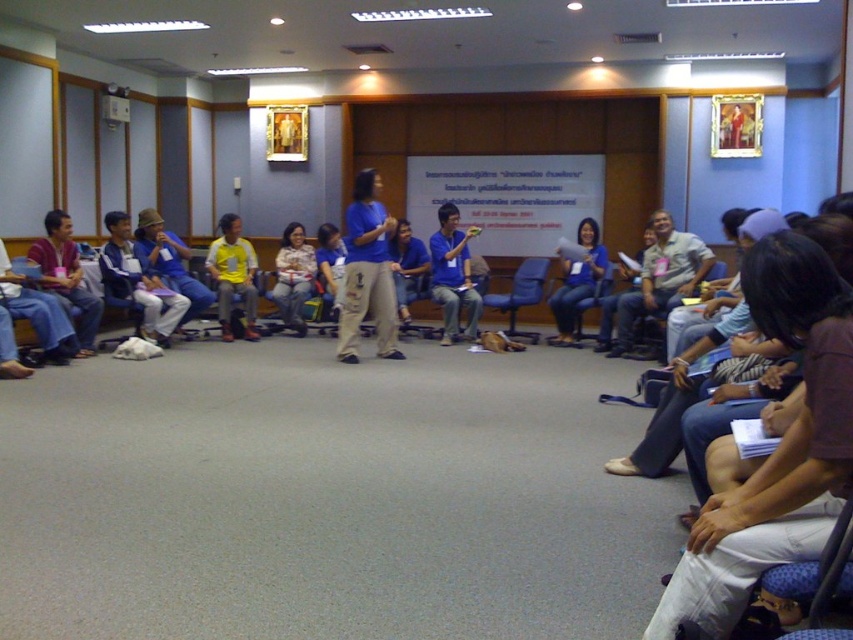
You are organizing a photo shoot and need to ensure that the matte blue shirt at center and the metallic blue chair at center are both visible in the frame. Based on their sizes, which object should you prioritize positioning closer to the camera to avoid being obscured?

The matte blue shirt at center might be wider than the metallic blue chair at center, so you should prioritize positioning the matte blue shirt at center closer to the camera to ensure it is fully visible and not obscured by the chair.

You are a person standing at the entrance of the conference room. You need to walk to the light brown fabric pants at center and the matte plastic chair at center. Which one is closer to you?

Both the light brown fabric pants at center and the matte plastic chair at center are 9.27 feet away from you, so they are equally distant.

You are standing in the conference room and see the light brown fabric pants at center and the metallic blue chair at center. Which object is closer to you?

The light brown fabric pants at center is closer to you because it is further to the viewer than the metallic blue chair at center.